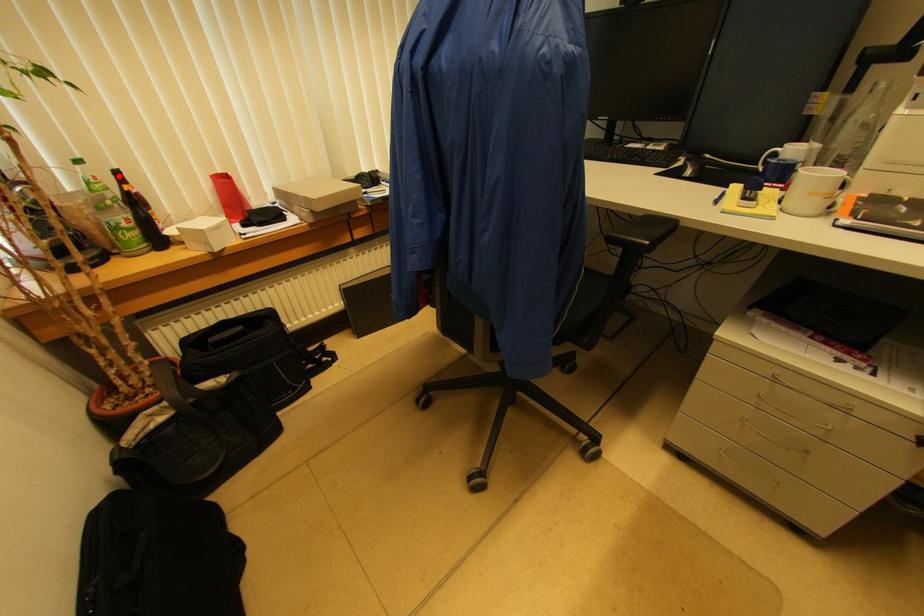
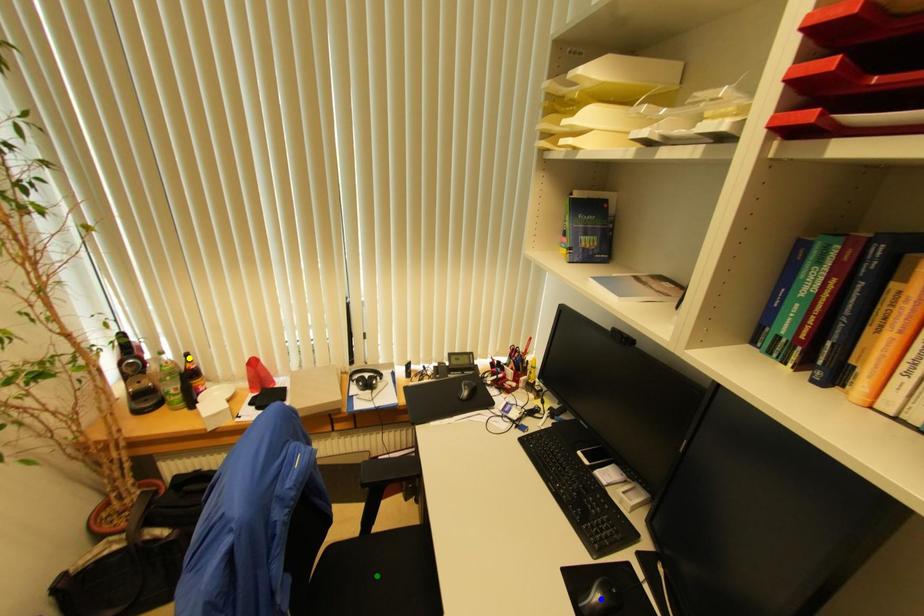
Question: I am providing you with two images of the same scene from different viewpoints. A red point is marked on the first image. You are given multiple points on the second image. Which point in image 2 is actually the same real-world point as the red point in image 1?

Choices:
 (A) yellow point
 (B) green point
 (C) blue point

Answer: (A)